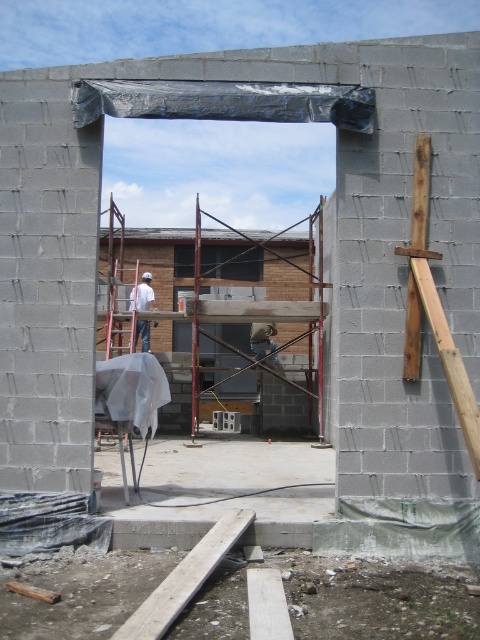
Between white matte construction worker at left and light brown leather helmet at center, which one has less height?

white matte construction worker at left

Find the location of a particular element. Image resolution: width=480 pixels, height=640 pixels. white matte construction worker at left is located at coordinates (144, 292).

Which is in front, point (136, 289) or point (256, 349)?

Point (136, 289) is in front.

You are a GUI agent. You are given a task and a screenshot of the screen. Output one action in this format:
    pyautogui.click(x=<x>, y=<y>)
    Task: Click on the white matte construction worker at left
    
    Given the screenshot: What is the action you would take?
    pyautogui.click(x=144, y=292)

Measure the distance from gray wood beam at lower center to white matte construction worker at left.

41.03 feet

Is the position of gray wood beam at lower center more distant than that of white matte construction worker at left?

No, gray wood beam at lower center is in front of white matte construction worker at left.

What do you see at coordinates (184, 579) in the screenshot? I see `gray wood beam at lower center` at bounding box center [184, 579].

Identify the location of gray wood beam at lower center. (184, 579).

Is gray wood beam at lower center smaller than light brown leather helmet at center?

Correct, gray wood beam at lower center occupies less space than light brown leather helmet at center.

Where is `gray wood beam at lower center`? The width and height of the screenshot is (480, 640). gray wood beam at lower center is located at coordinates (184, 579).

Is point (205, 560) farther from camera compared to point (253, 353)?

No.

Where is `gray wood beam at lower center`? gray wood beam at lower center is located at coordinates (184, 579).